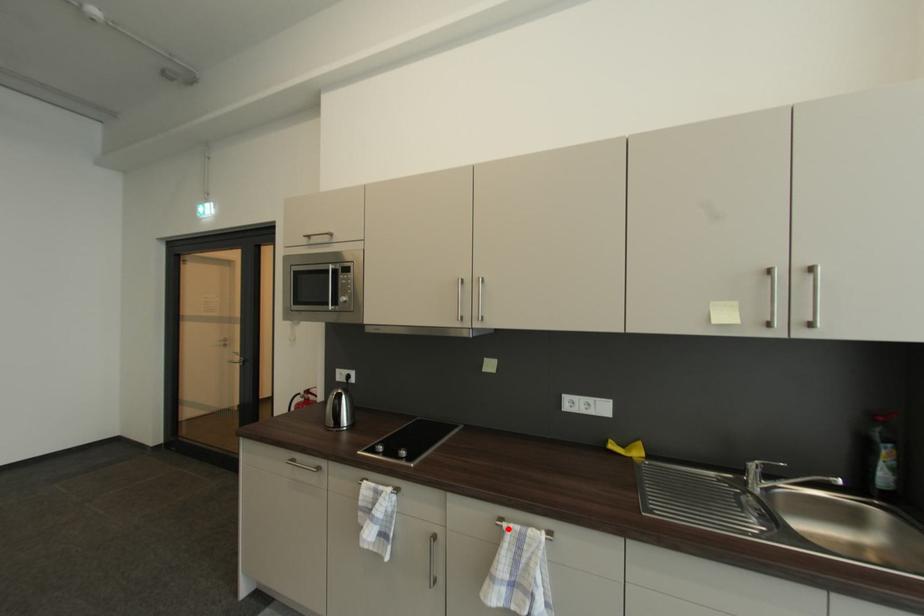
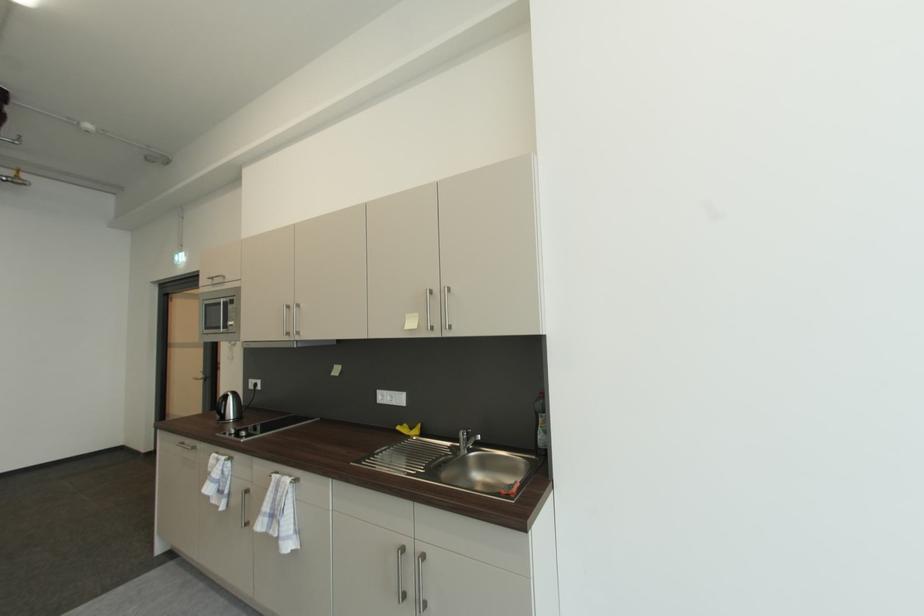
The point at the highlighted location is marked in the first image. Where is the corresponding point in the second image?

(277, 477)